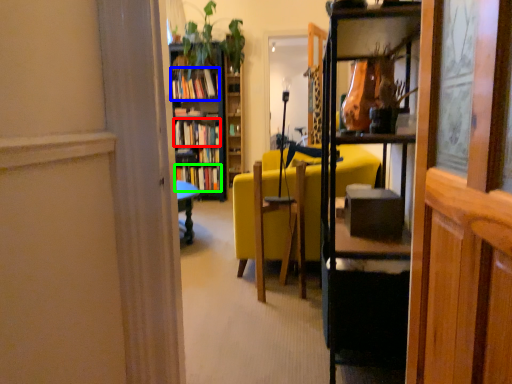
Question: Which is farther away from book (highlighted by a red box)? book (highlighted by a blue box) or book (highlighted by a green box)?

Choices:
 (A) book
 (B) book

Answer: (A)